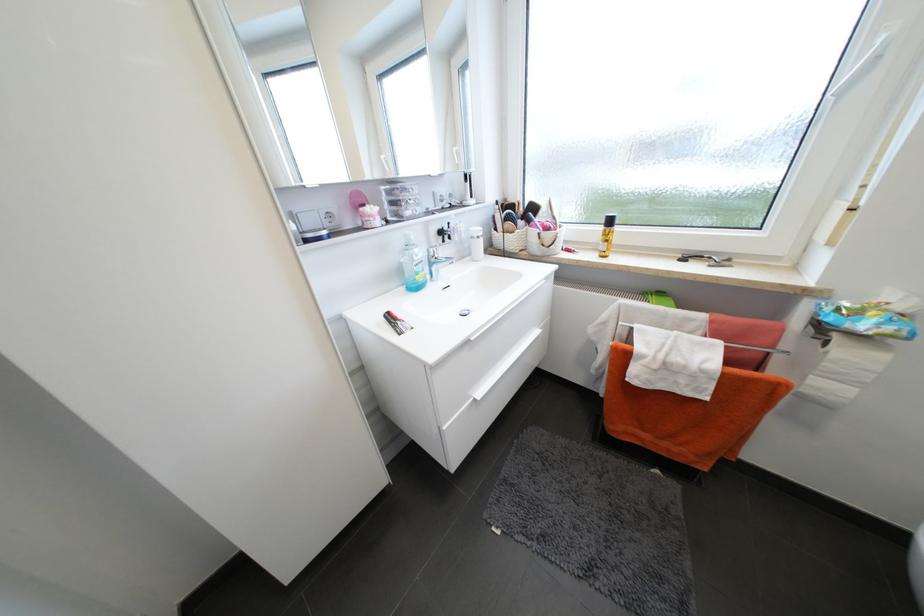
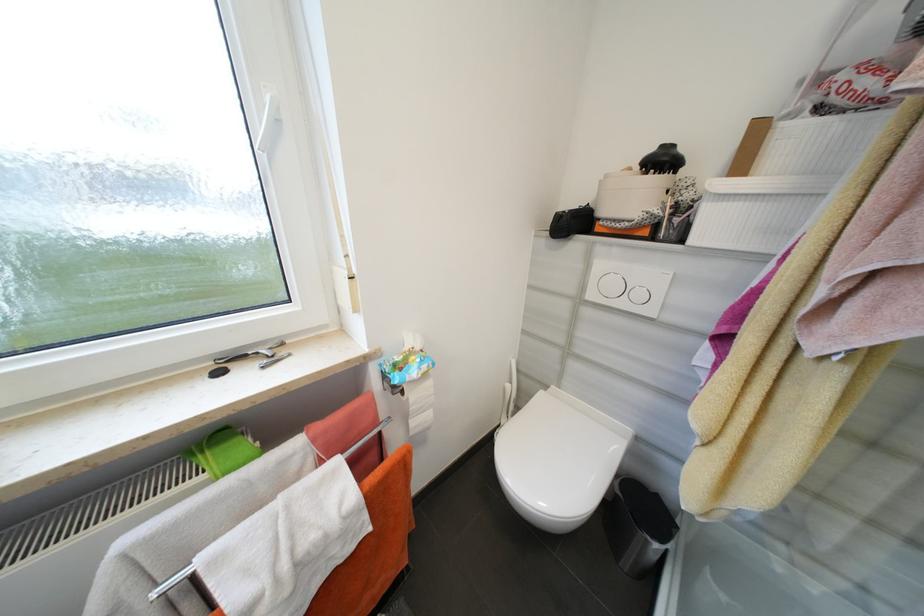
In the second image, find the point that corresponds to pixel 895 330 in the first image.

(430, 368)